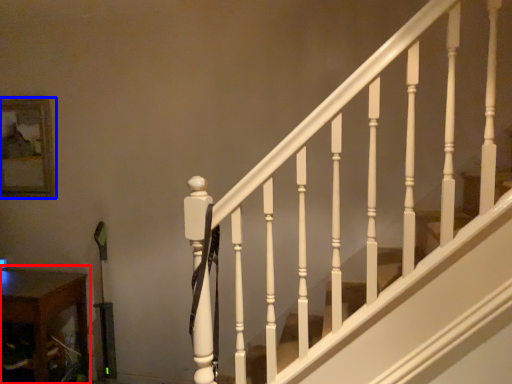
Question: Which point is closer to the camera, table (highlighted by a red box) or picture frame (highlighted by a blue box)?

Choices:
 (A) table
 (B) picture frame

Answer: (A)